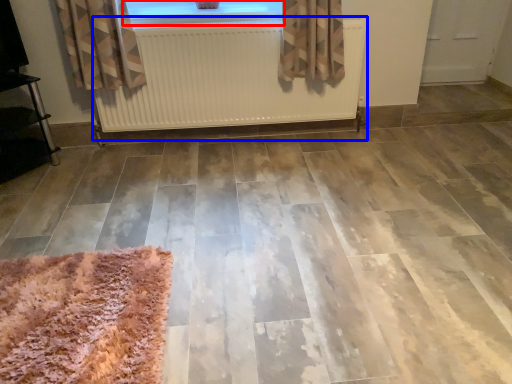
Question: Which point is closer to the camera, window (highlighted by a red box) or radiator (highlighted by a blue box)?

Choices:
 (A) window
 (B) radiator

Answer: (B)